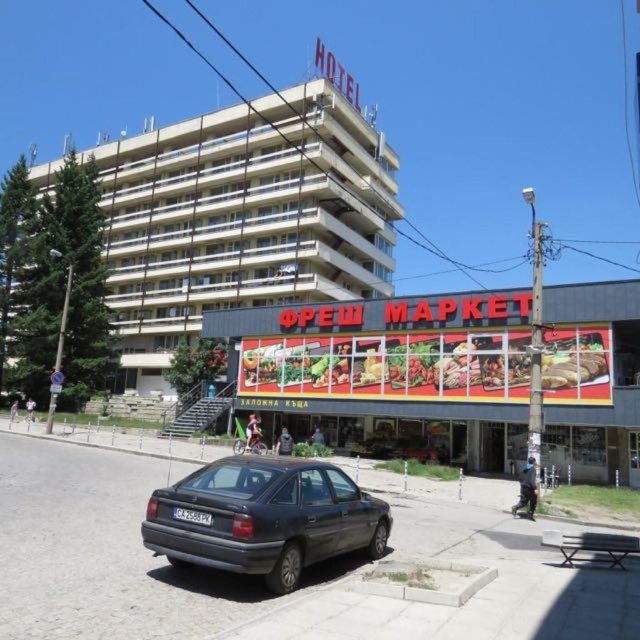
Does beige concrete building at upper center appear over matte dark gray sedan at lower center?

Correct, beige concrete building at upper center is located above matte dark gray sedan at lower center.

Does beige concrete building at upper center have a smaller size compared to matte dark gray sedan at lower center?

Actually, beige concrete building at upper center might be larger than matte dark gray sedan at lower center.

Who is more forward, (292, 192) or (346, 477)?

Point (346, 477) is in front.

This screenshot has width=640, height=640. I want to click on beige concrete building at upper center, so click(x=241, y=218).